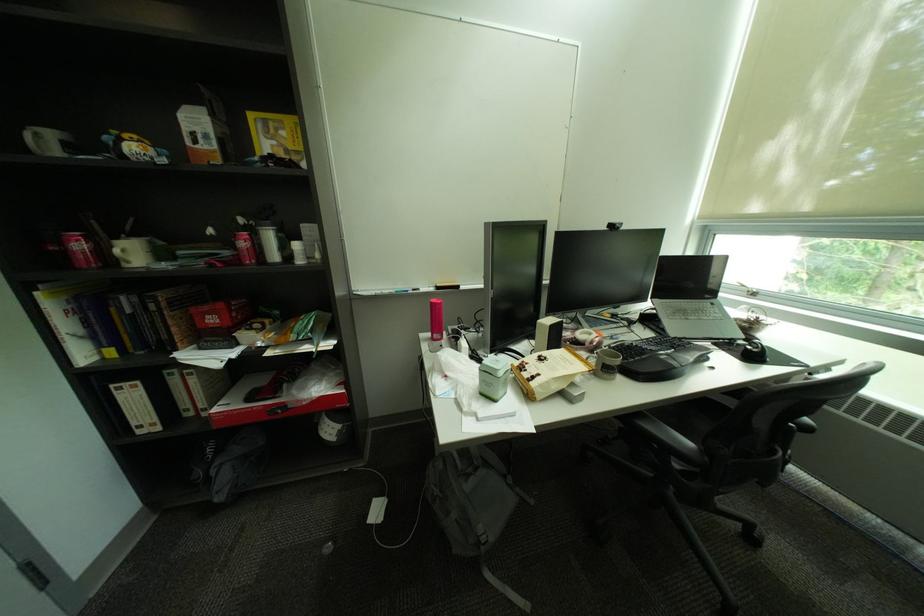
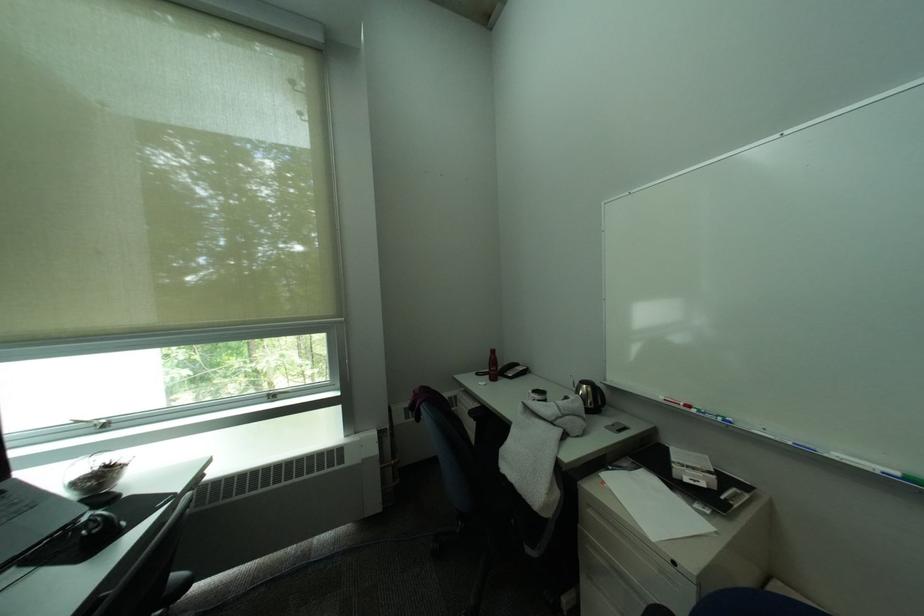
Find the pixel in the second image that matches [767,350] in the first image.

(106, 528)